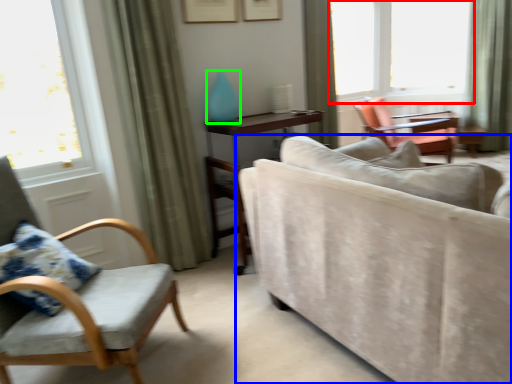
Question: Considering the real-world distances, which object is farthest from window (highlighted by a red box)? studio couch (highlighted by a blue box) or turquoise (highlighted by a green box)?

Choices:
 (A) studio couch
 (B) turquoise

Answer: (A)